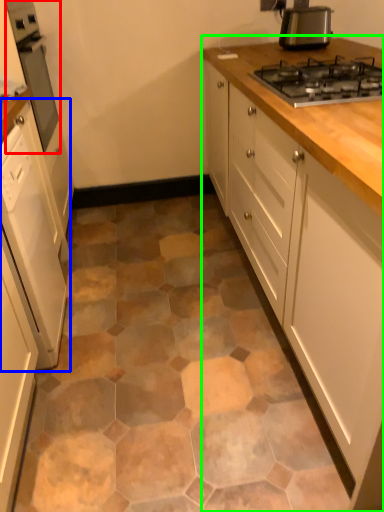
Question: Which is nearer to the home appliance (highlighted by a red box)? cabinetry (highlighted by a blue box) or cabinetry (highlighted by a green box).

Choices:
 (A) cabinetry
 (B) cabinetry

Answer: (A)